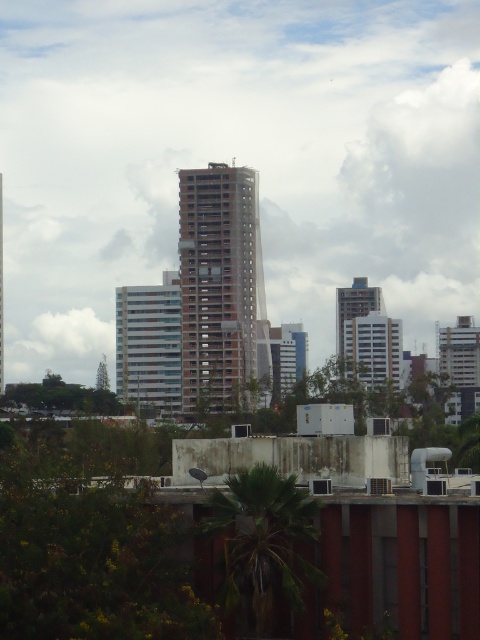
Question: Which point is closer to the camera?

Choices:
 (A) (216, 188)
 (B) (156, 380)
 (C) (360, 280)

Answer: (A)

Question: Is brown concrete building at center closer to the viewer compared to matte gray building at center?

Choices:
 (A) yes
 (B) no

Answer: (A)

Question: Does brown concrete building at center come behind white glossy building at center?

Choices:
 (A) no
 (B) yes

Answer: (A)

Question: Considering the real-world distances, which object is farthest from the matte gray building at center?

Choices:
 (A) white glossy building at center
 (B) brown concrete building at center

Answer: (A)

Question: Can you confirm if white glossy building at center is thinner than matte gray building at center?

Choices:
 (A) yes
 (B) no

Answer: (B)

Question: Which point is farther to the camera?

Choices:
 (A) brown concrete building at center
 (B) matte gray building at center
 (C) white glossy building at center

Answer: (B)